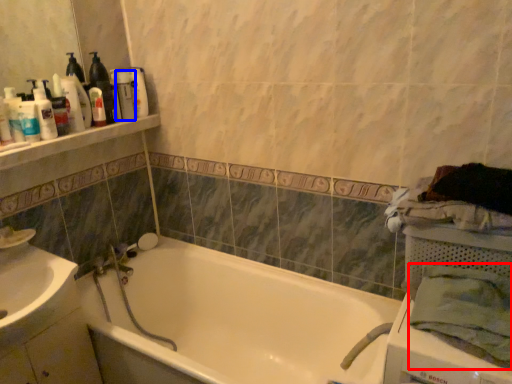
Question: Which point is closer to the camera, bath towel (highlighted by a red box) or toiletry (highlighted by a blue box)?

Choices:
 (A) bath towel
 (B) toiletry

Answer: (A)